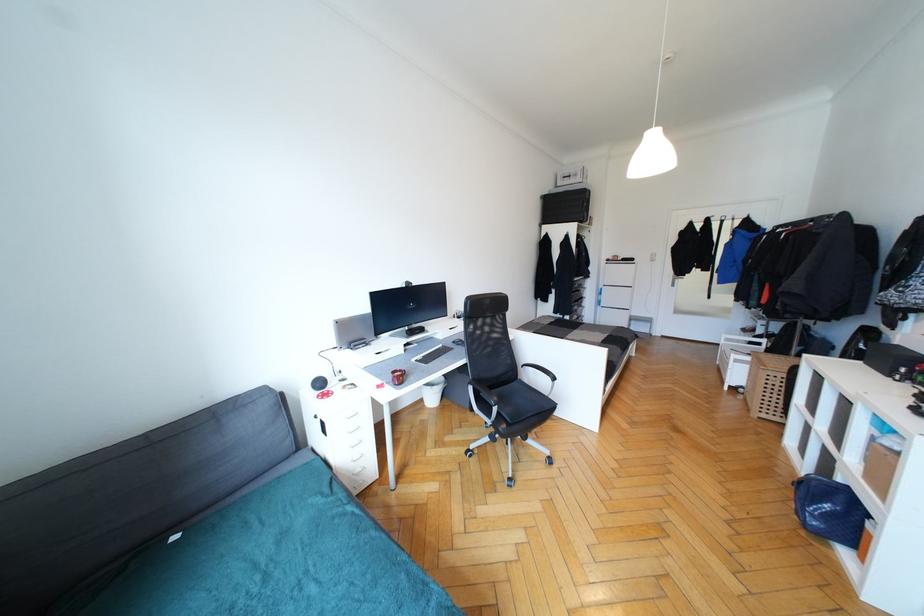
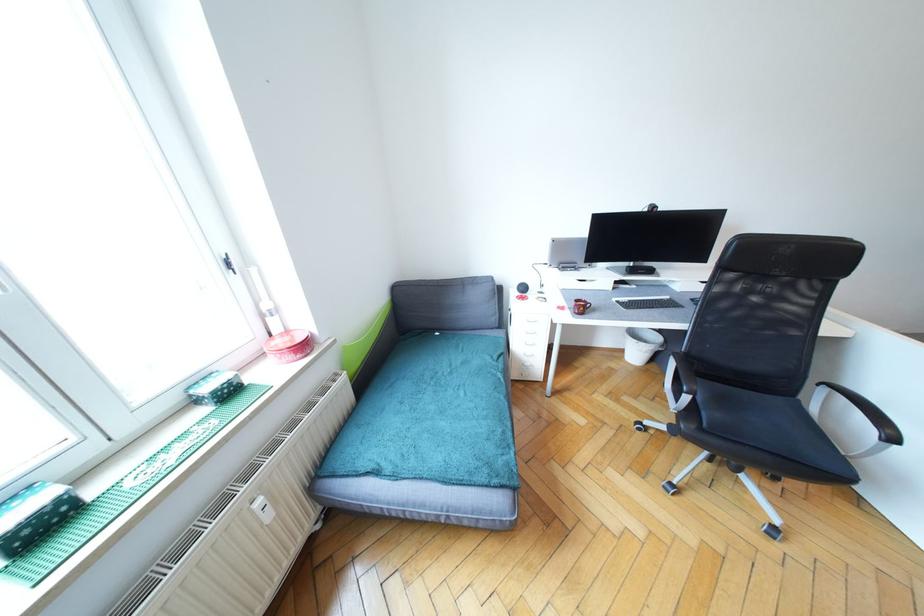
Where in the second image is the point corresponding to pixel 403 371 from the first image?

(589, 302)